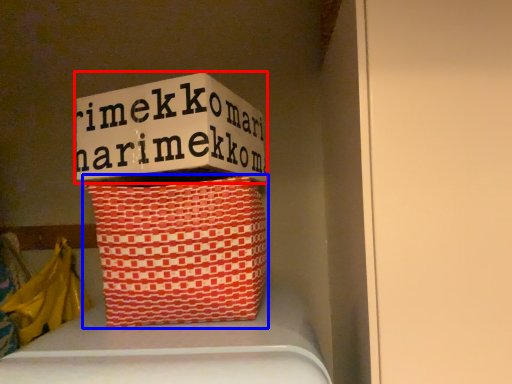
Question: Among these objects, which one is farthest to the camera, box (highlighted by a red box) or basket (highlighted by a blue box)?

Choices:
 (A) box
 (B) basket

Answer: (A)